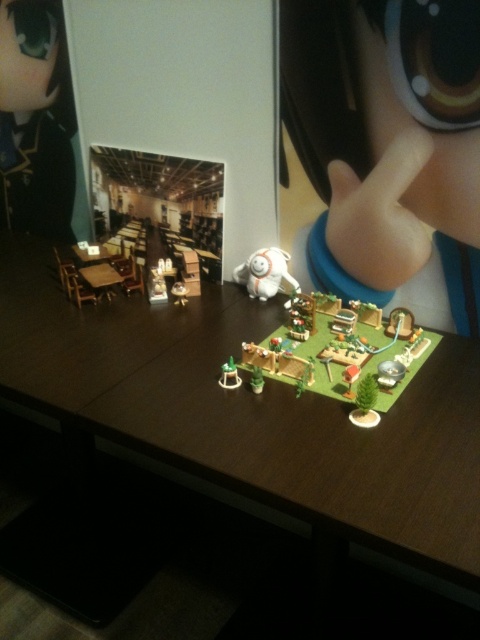
Looking at this image, you are setting up a miniature diorama on a desk and want to place a new miniature item exactly where the white plush toy at center is currently located. What are the coordinates of the spot where you should place the new item?

The coordinates for the white plush toy at center are at point (264, 273). Place the new item at those coordinates.

You are a small toy mouse that wants to hide from a cat. You see a white plush toy at center and a wooden table at left. Which object can you hide under to avoid being seen?

The white plush toy at center is positioned under the wooden table at left, so hiding under the wooden table at left would be the best option to avoid the cat.